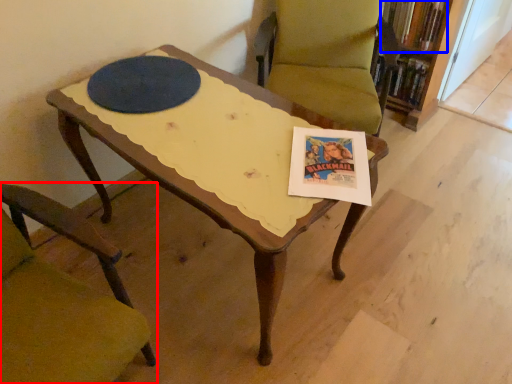
Question: Which object appears farthest to the camera in this image, chair (highlighted by a red box) or book (highlighted by a blue box)?

Choices:
 (A) chair
 (B) book

Answer: (B)